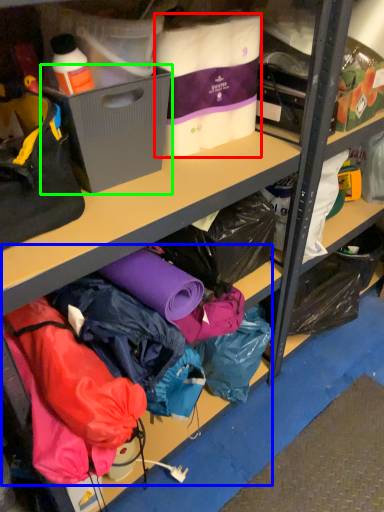
Question: Based on their relative distances, which object is nearer to clothing (highlighted by a red box)? Choose from clothing (highlighted by a blue box) and box (highlighted by a green box).

Choices:
 (A) clothing
 (B) box

Answer: (B)